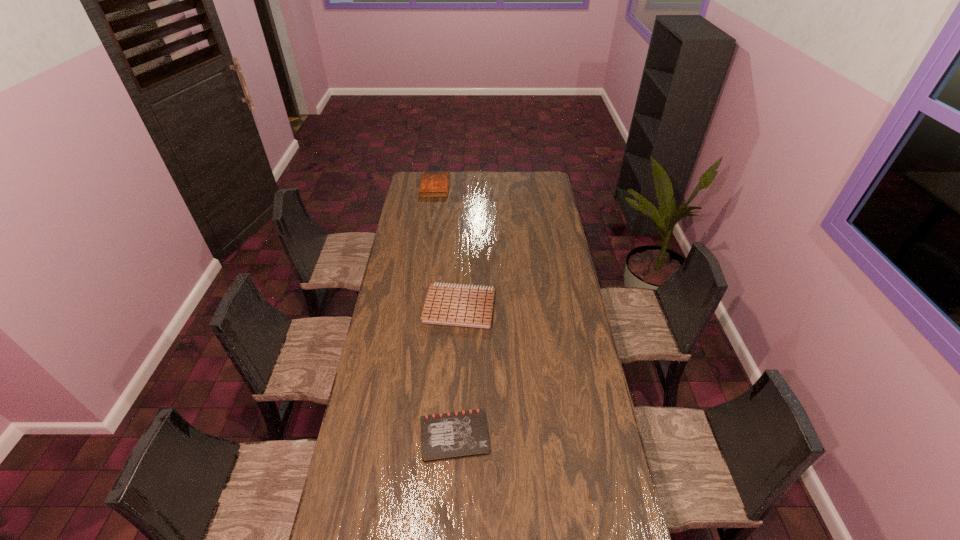
Find the location of `free area in between the taller notebook and the shorter notebook`. free area in between the taller notebook and the shorter notebook is located at coordinates (457, 371).

The image size is (960, 540). Identify the location of empty space between the nearest object and the taller notebook. (457, 371).

You are a GUI agent. You are given a task and a screenshot of the screen. Output one action in this format:
    pyautogui.click(x=<x>, y=<y>)
    Task: Click on the free space between the tallest object and the farther notebook
    
    Given the screenshot: What is the action you would take?
    (x=447, y=247)

Choose which object is the second nearest neighbor to the nearest object. Please provide its 2D coordinates. Your answer should be formatted as a tuple, i.e. [(x, y)], where the tuple contains the x and y coordinates of a point satisfying the conditions above.

[(433, 184)]

The width and height of the screenshot is (960, 540). I want to click on object that is the closest one to the tallest object, so click(x=465, y=306).

Locate an element on the screen. vacant point that satisfies the following two spatial constraints: 1. on the back side of the shortest object; 2. on the spine side of the farthest object is located at coordinates (466, 187).

Where is `blank area in the image that satisfies the following two spatial constraints: 1. on the spine side of the Bible; 2. on the back side of the shorter notebook`? The height and width of the screenshot is (540, 960). blank area in the image that satisfies the following two spatial constraints: 1. on the spine side of the Bible; 2. on the back side of the shorter notebook is located at coordinates (400, 436).

Identify the location of free point that satisfies the following two spatial constraints: 1. on the front side of the second nearest object; 2. on the left side of the shorter notebook. (453, 436).

At what (x,y) coordinates should I click in order to perform the action: click on blank area in the image that satisfies the following two spatial constraints: 1. on the spine side of the farthest object; 2. on the left side of the taller notebook. Please return your answer as a coordinate pair (x, y). Looking at the image, I should click on (419, 307).

Where is `vacant point that satisfies the following two spatial constraints: 1. on the spine side of the Bible; 2. on the left side of the second nearest object`? This screenshot has width=960, height=540. vacant point that satisfies the following two spatial constraints: 1. on the spine side of the Bible; 2. on the left side of the second nearest object is located at coordinates (419, 307).